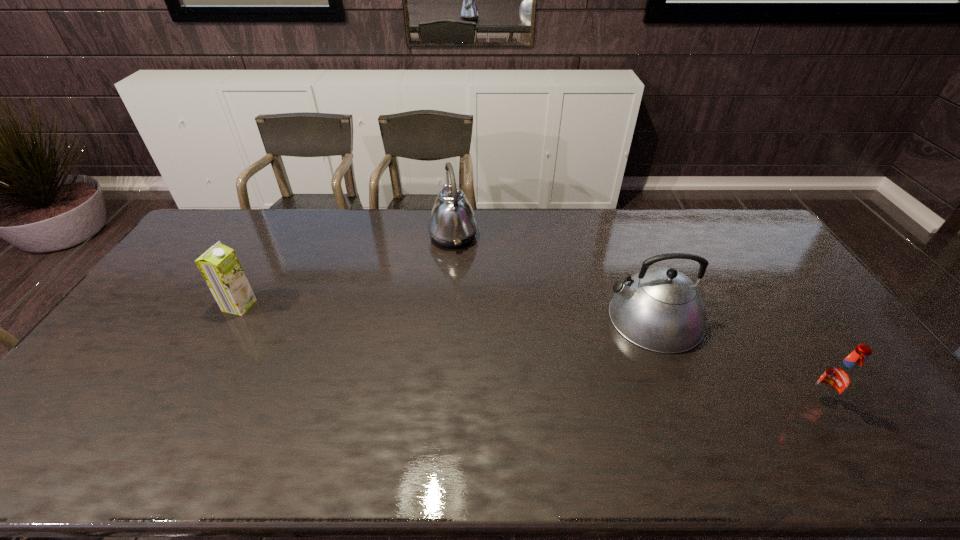
Where is `vacant space situated 0.270m from the spout of the shorter kettle`? vacant space situated 0.270m from the spout of the shorter kettle is located at coordinates (516, 318).

This screenshot has height=540, width=960. Find the location of `vacant area situated on the front of the soya milk`. vacant area situated on the front of the soya milk is located at coordinates (219, 342).

The width and height of the screenshot is (960, 540). Find the location of `blank area located on the back of the root beer`. blank area located on the back of the root beer is located at coordinates (780, 343).

Locate an element on the screen. This screenshot has height=540, width=960. object positioned at the far edge is located at coordinates (452, 223).

You are a GUI agent. You are given a task and a screenshot of the screen. Output one action in this format:
    pyautogui.click(x=<x>, y=<y>)
    Task: Click on the blank space at the far edge of the desktop
    The image size is (960, 540).
    Given the screenshot: What is the action you would take?
    pyautogui.click(x=620, y=217)

Locate an element on the screen. free space at the left edge of the desktop is located at coordinates (188, 290).

Locate an element on the screen. The height and width of the screenshot is (540, 960). vacant space at the right edge is located at coordinates (845, 407).

Locate an element on the screen. This screenshot has height=540, width=960. free point at the far right corner is located at coordinates (710, 215).

Where is `unoccupied position between the third object from right to left and the leftmost object`? unoccupied position between the third object from right to left and the leftmost object is located at coordinates (347, 271).

You are a GUI agent. You are given a task and a screenshot of the screen. Output one action in this format:
    pyautogui.click(x=<x>, y=<y>)
    Task: Click on the free spot between the farthest object and the leftmost object
    
    Given the screenshot: What is the action you would take?
    pyautogui.click(x=347, y=271)